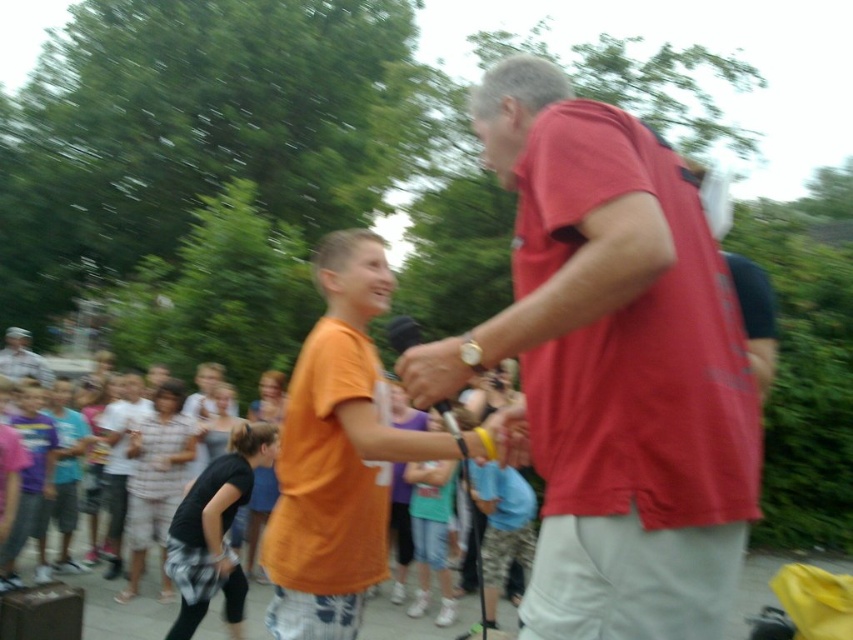
Based on the scene description, which object is closer to the viewer between the orange cotton shirt at center and the plaid shirt at center?

The orange cotton shirt at center is closer to the viewer than the plaid shirt at center.

You are a photographer trying to capture a group photo of the plaid shirt at center and the camouflage uniform at lower left. Based on their sizes, which one should you position closer to the camera to ensure both appear equally sized in the photo?

The plaid shirt at center has a lesser width compared to camouflage uniform at lower left. To make both appear equally sized in the photo, position the plaid shirt at center closer to the camera since it is narrower and needs to be magnified to match the size of the camouflage uniform at lower left.